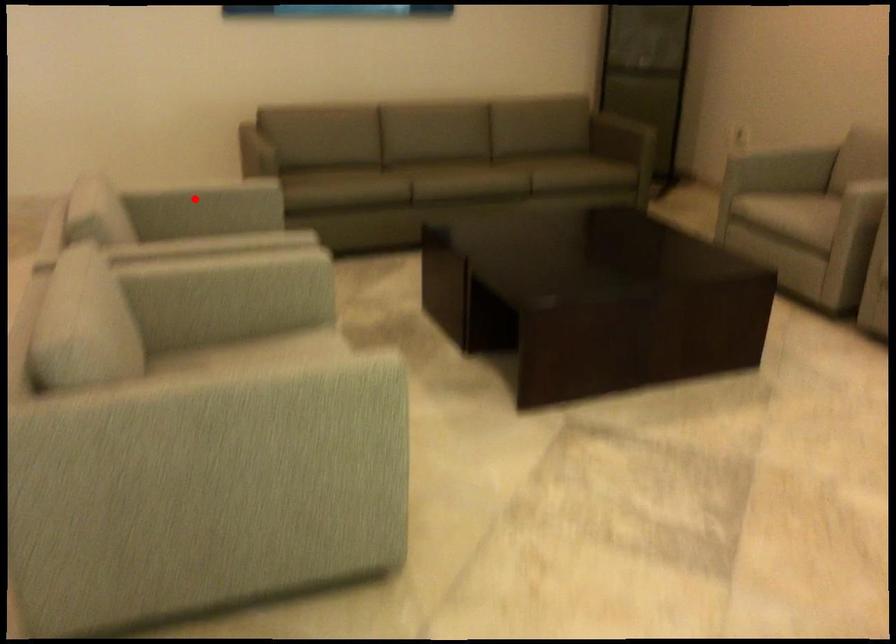
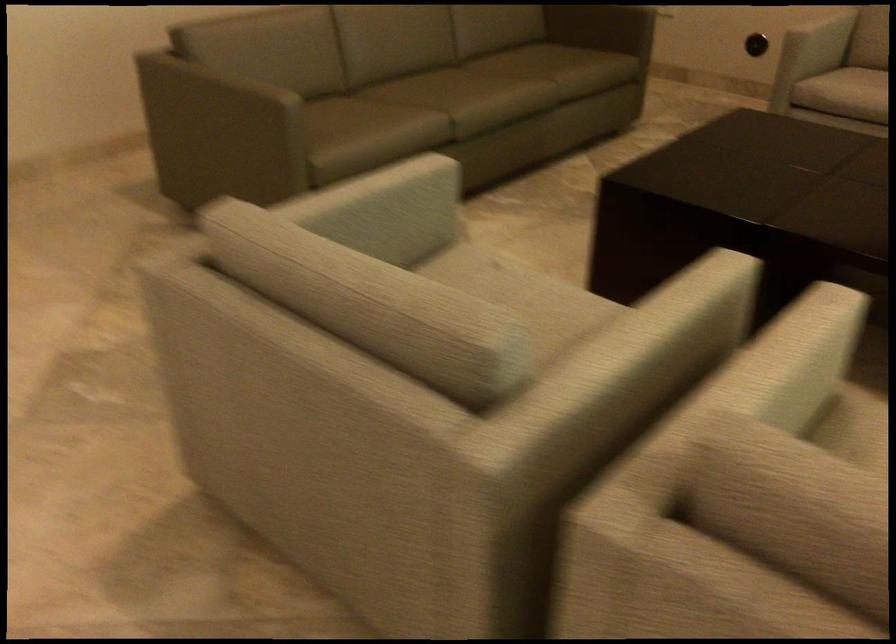
Question: A red point is marked in image1. In image2, is the corresponding 3D point closer to the camera or farther? Reply with the corresponding letter.

Choices:
 (A) The corresponding 3D point is closer.
 (B) The corresponding 3D point is farther.

Answer: (A)